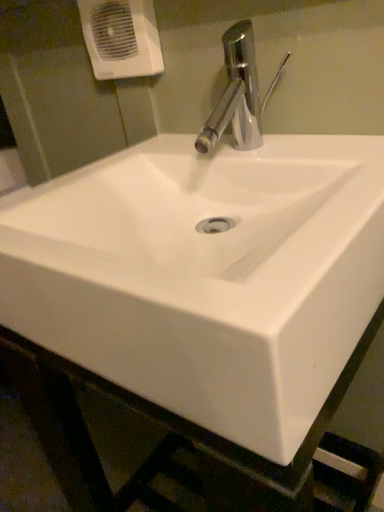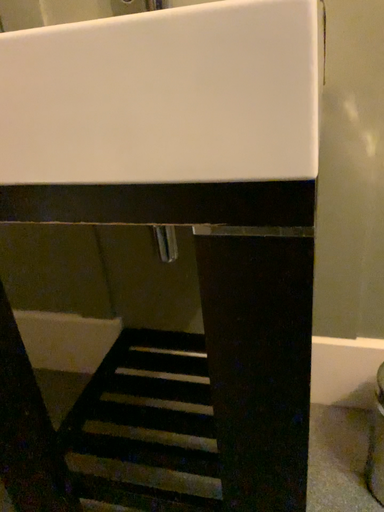
Question: How did the camera likely rotate when shooting the video?

Choices:
 (A) rotated right
 (B) rotated left

Answer: (A)